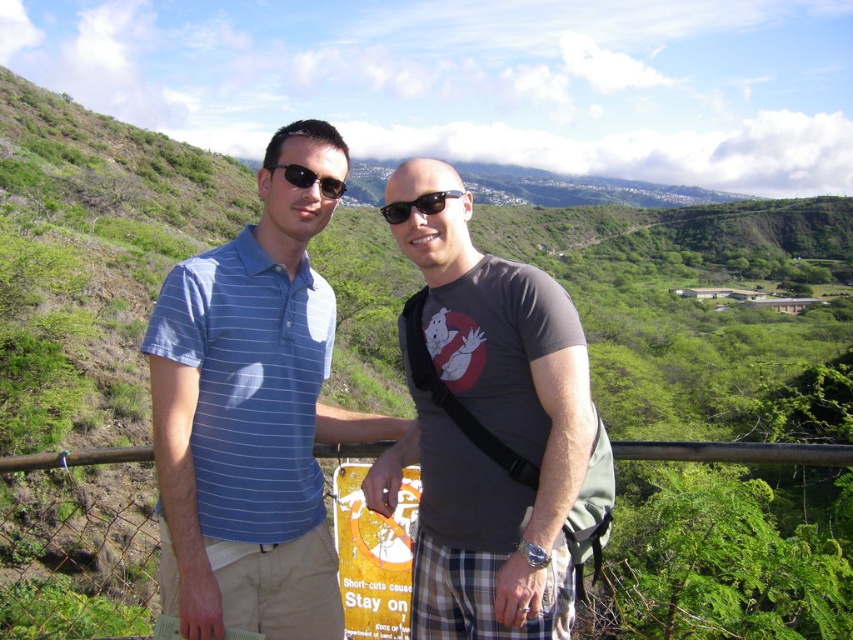
You are a photographer trying to capture a group photo of the two people in the scene. The camera you are using has a limited field of view that can only capture objects within a 0.5 unit radius centered at point 0.5, 0.5. Will the blue striped polo shirt at center be within this field of view?

The blue striped polo shirt at center is located at point (252, 413). The distance from this point to the center of the field of view at (426, 320) can be calculated using the Euclidean distance formula. The horizontal distance is 0.648 minus 0.5 equals 0.148 units, and the vertical distance is 0.297 minus 0.5 equals negative 0.203 units. Squaring both distances gives 0.0219 and 0.0412, respectively. Adding them together gives 0.0631, and taking the square root results in approximately 0.251 units. Since 0.

You are standing at the scenic overlook and want to take a photo of both the person on the left and the person on the right. The coordinates of their positions are point (279, 268) and point (491, 472) respectively. Based on their positions, which person is closer to the camera?

Point (279, 268) is behind point (491, 472), so the person at point (491, 472) is closer to the camera.